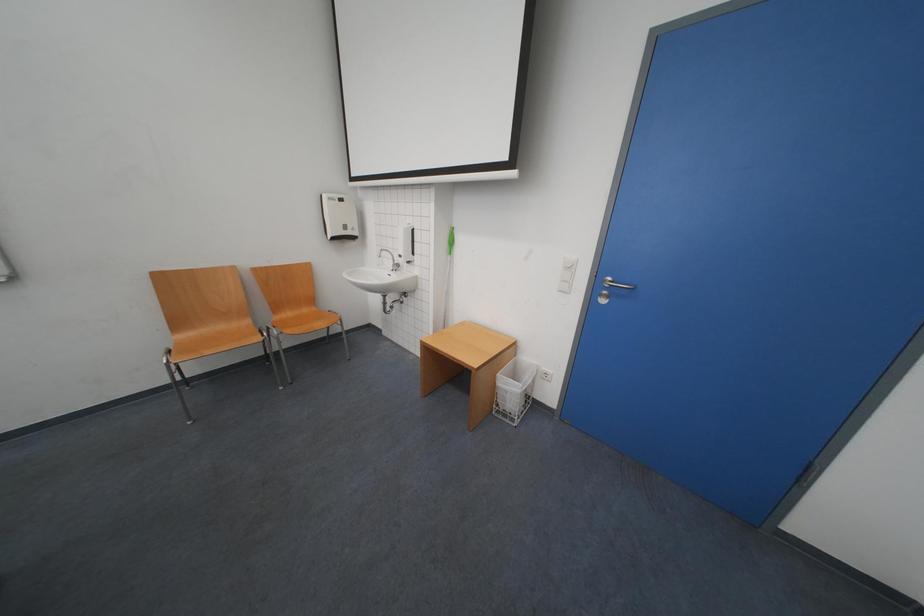
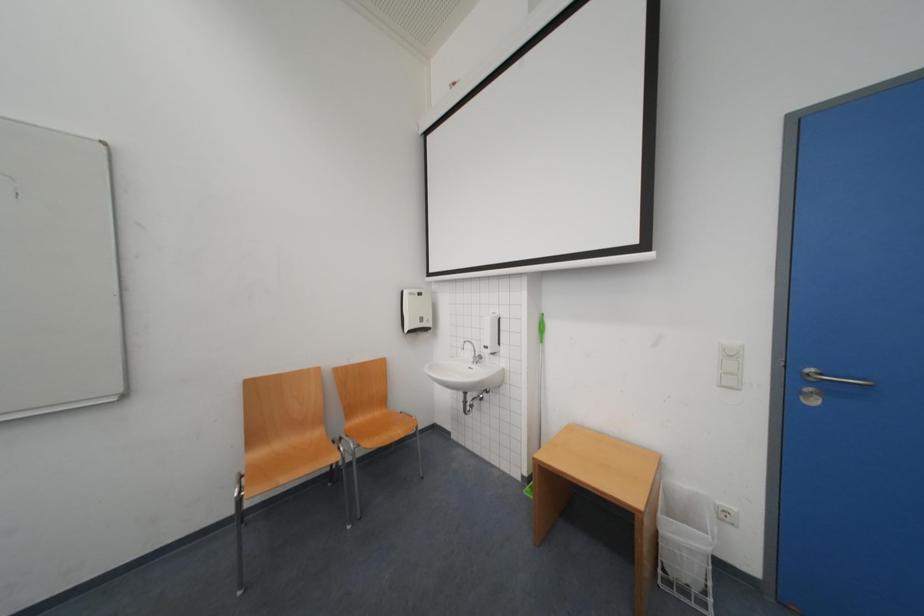
Question: The images are taken continuously from a first-person perspective. In which direction is your viewpoint rotating?

Choices:
 (A) Left
 (B) Right
 (C) Up
 (D) Down

Answer: (C)